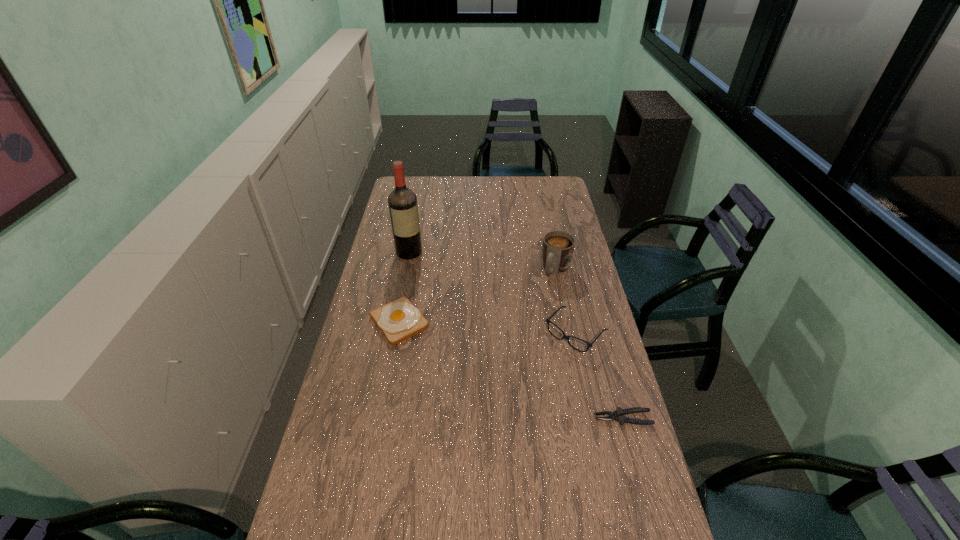
The image size is (960, 540). I want to click on vacant area between the second shortest object and the third tallest object, so [x=488, y=327].

Where is `empty space that is in between the second tallest object and the toast`? This screenshot has height=540, width=960. empty space that is in between the second tallest object and the toast is located at coordinates (478, 296).

The height and width of the screenshot is (540, 960). I want to click on unoccupied position between the toast and the tallest object, so click(x=404, y=287).

Identify the location of blank region between the toast and the third shortest object. (488, 327).

Locate an element on the screen. vacant space that is in between the pliers and the tallest object is located at coordinates (516, 335).

Locate an element on the screen. vacant area that lies between the liquor and the second tallest object is located at coordinates (483, 261).

Image resolution: width=960 pixels, height=540 pixels. What are the coordinates of `blank region between the mug and the toast` in the screenshot? It's located at (478, 296).

This screenshot has height=540, width=960. Identify the location of vacant space in between the fourth tallest object and the nearest object. (511, 370).

Where is `free space between the pliers and the third tallest object`? free space between the pliers and the third tallest object is located at coordinates (599, 375).

Find the location of a particular element. This screenshot has height=540, width=960. object that is the closest to the tallest object is located at coordinates (399, 320).